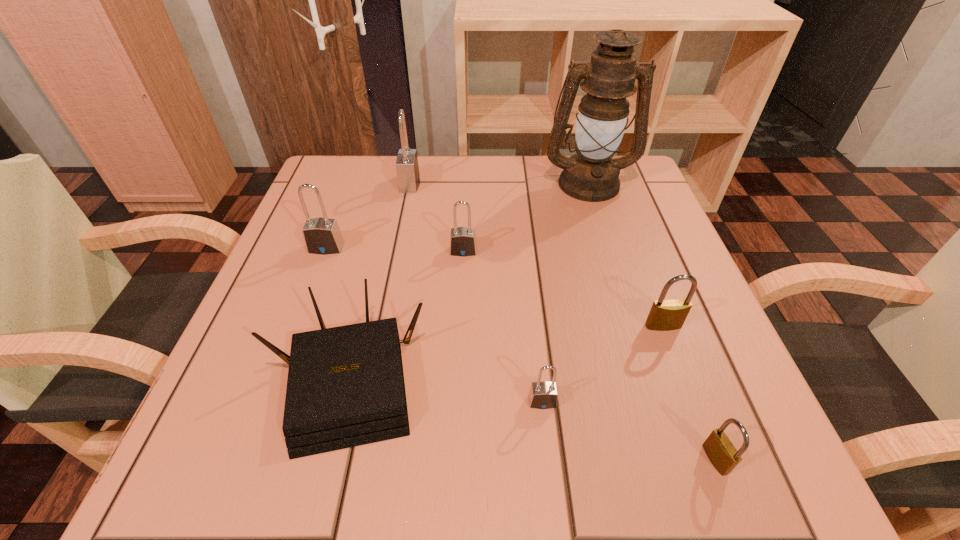
Image resolution: width=960 pixels, height=540 pixels. Find the location of `the third closest padlock to the smaller brass padlock`. the third closest padlock to the smaller brass padlock is located at coordinates (462, 239).

The width and height of the screenshot is (960, 540). I want to click on gray padlock object that ranks as the third closest to the fourth object from left to right, so [x=543, y=395].

This screenshot has height=540, width=960. What are the coordinates of `gray padlock that is the third closest to the seventh shortest object` in the screenshot? It's located at (543, 395).

Identify the location of blank area in the image that satisfies the following two spatial constraints: 1. on the front side of the nearest padlock; 2. on the right side of the farther brass padlock. (712, 459).

Locate an element on the screen. free space that satisfies the following two spatial constraints: 1. on the shackle of the farthest padlock; 2. on the shackle of the sixth shortest object is located at coordinates (396, 248).

Image resolution: width=960 pixels, height=540 pixels. In order to click on vacant space that satisfies the following two spatial constraints: 1. on the shackle of the bigger brass padlock; 2. on the right side of the third gray padlock from left to right in this screenshot , I will do `click(460, 326)`.